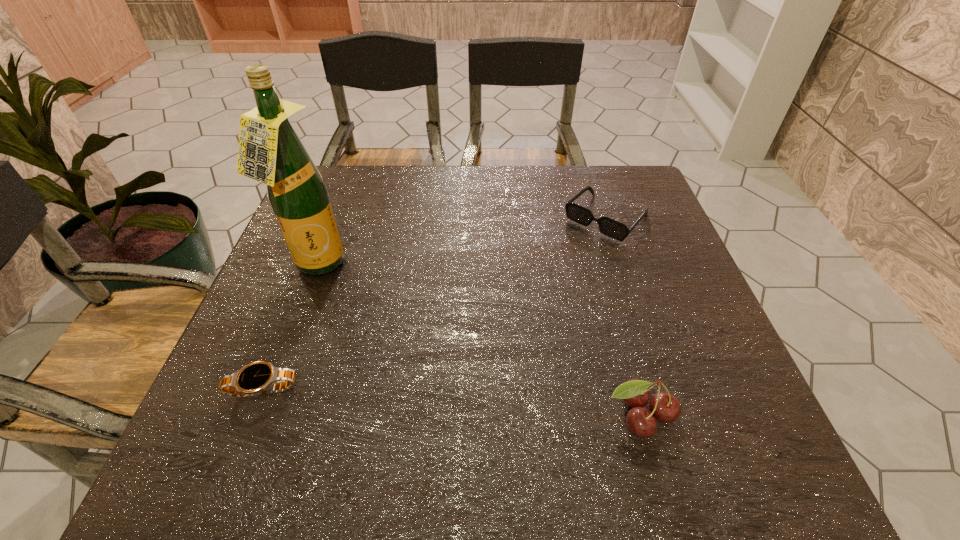
Identify the location of vacant space that satisfies the following two spatial constraints: 1. on the back side of the liquor; 2. on the right side of the watch. (311, 266).